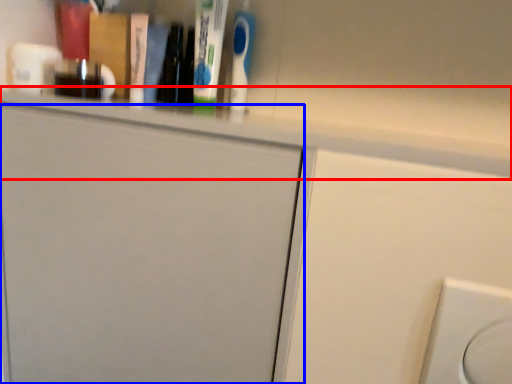
Question: Which of the following is the closest to the observer, ledge (highlighted by a red box) or door (highlighted by a blue box)?

Choices:
 (A) ledge
 (B) door

Answer: (A)